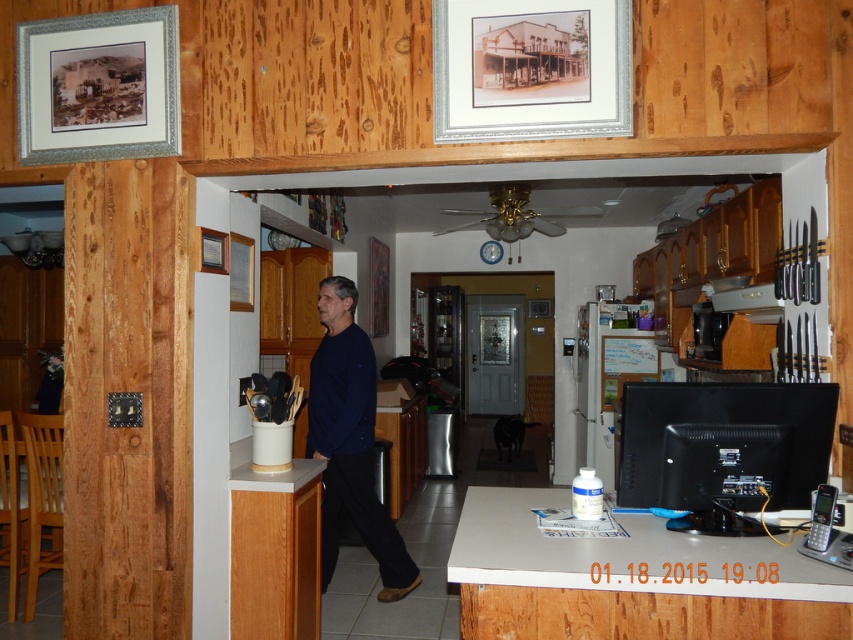
Which is behind, point (621, 74) or point (257, 442)?

Point (257, 442)

The width and height of the screenshot is (853, 640). What do you see at coordinates (531, 68) in the screenshot?
I see `silver metallic picture frame at upper center` at bounding box center [531, 68].

What are the coordinates of `silver metallic picture frame at upper center` in the screenshot? It's located at (531, 68).

Does silver metallic picture frame at upper center appear over matte black monitor at right?

Correct, silver metallic picture frame at upper center is located above matte black monitor at right.

Which is more to the left, silver metallic picture frame at upper center or matte black monitor at right?

Positioned to the left is silver metallic picture frame at upper center.

At what (x,y) coordinates should I click in order to perform the action: click on silver metallic picture frame at upper center. Please return your answer as a coordinate pair (x, y). The height and width of the screenshot is (640, 853). Looking at the image, I should click on (531, 68).

Is silver metallic picture frame at upper left wider than wooden picture frame at upper left?

Indeed, silver metallic picture frame at upper left has a greater width compared to wooden picture frame at upper left.

Can you confirm if silver metallic picture frame at upper left is thinner than wooden picture frame at upper left?

Incorrect, silver metallic picture frame at upper left's width is not less than wooden picture frame at upper left's.

Which is in front, point (48, 64) or point (212, 236)?

Positioned in front is point (48, 64).

I want to click on silver metallic picture frame at upper left, so click(97, 86).